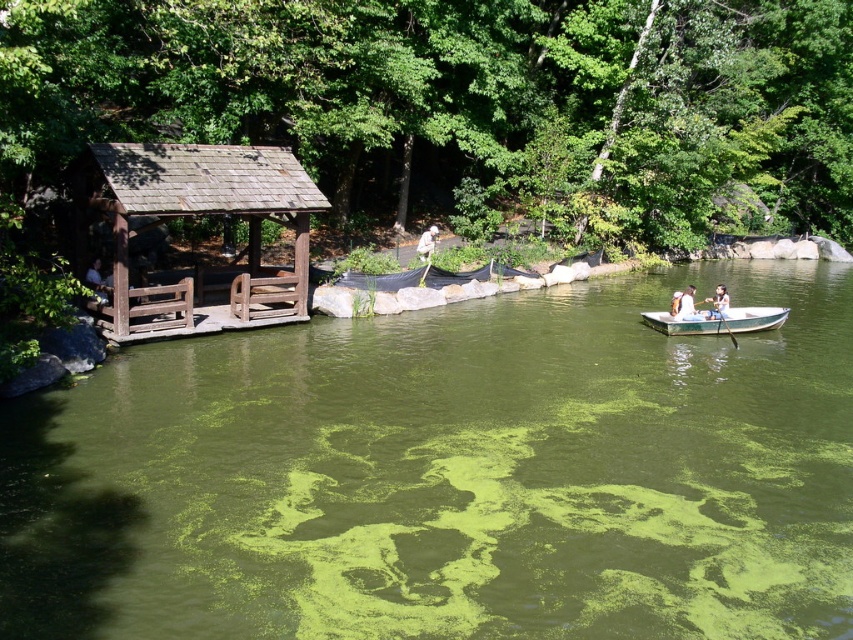
Question: Is wooden canoe at right smaller than white plastic paddle at right?

Choices:
 (A) no
 (B) yes

Answer: (A)

Question: Can you confirm if green algae-covered water at center is positioned to the right of white fur dog at center?

Choices:
 (A) no
 (B) yes

Answer: (B)

Question: Is the position of light brown wooden paddle at right less distant than that of white plastic paddle at right?

Choices:
 (A) yes
 (B) no

Answer: (B)

Question: Which object is closer to the camera taking this photo?

Choices:
 (A) white cotton shirt at center-right
 (B) white plastic paddle at right

Answer: (B)

Question: Which of these objects is positioned closest to the white cotton shirt at center-right?

Choices:
 (A) wooden canoe at right
 (B) wooden boat at right

Answer: (B)

Question: Which object is closer to the camera taking this photo?

Choices:
 (A) white cotton shirt at center-right
 (B) white plastic paddle at right
 (C) wooden boat at right
 (D) green algae-covered water at center

Answer: (D)